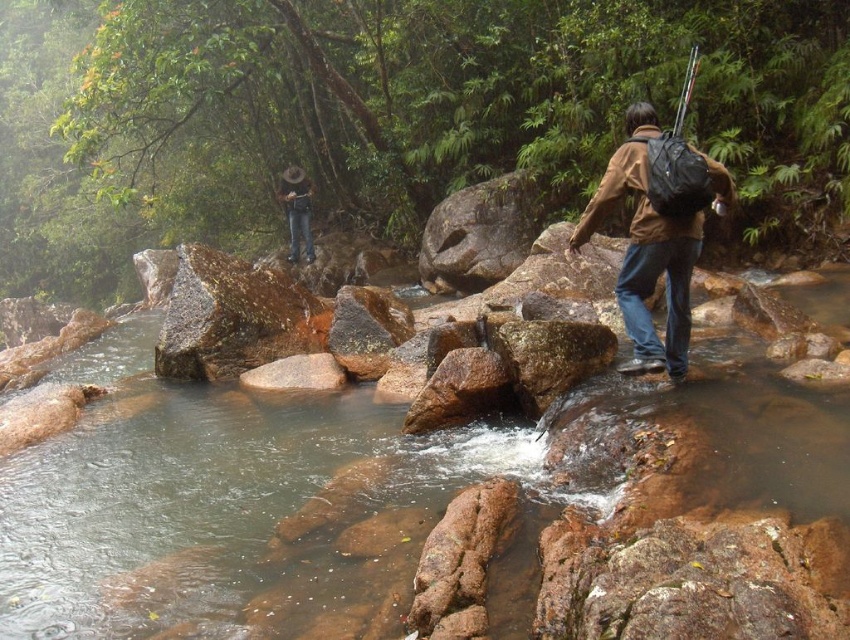
You are standing in the forest and see the brown rock at center and the brown leather hat at upper center. Which object is positioned to the right of the other?

The brown rock at center is to the right of the brown leather hat at upper center.

You are a hiker trying to cross the stream. You see a brown rock at center and a brown matte jacket at center. Which object is wider? Please choose between them.

The brown rock at center is wider than the brown matte jacket at center.